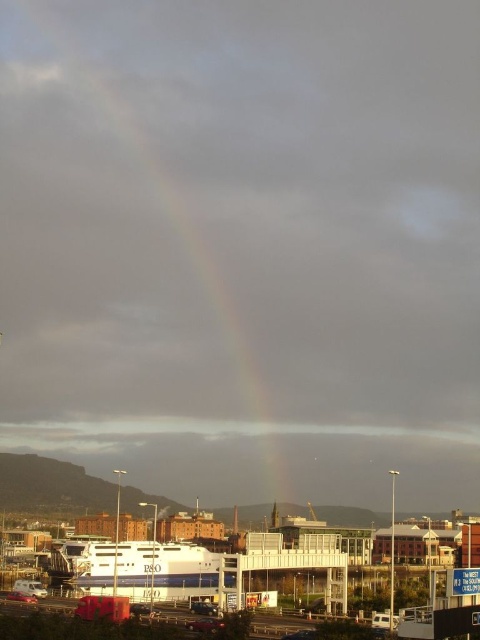
Can you confirm if rainbow at center is positioned to the right of white glossy ferry at center?

In fact, rainbow at center is to the left of white glossy ferry at center.

Image resolution: width=480 pixels, height=640 pixels. What are the coordinates of `rainbow at center` in the screenshot? It's located at (155, 241).